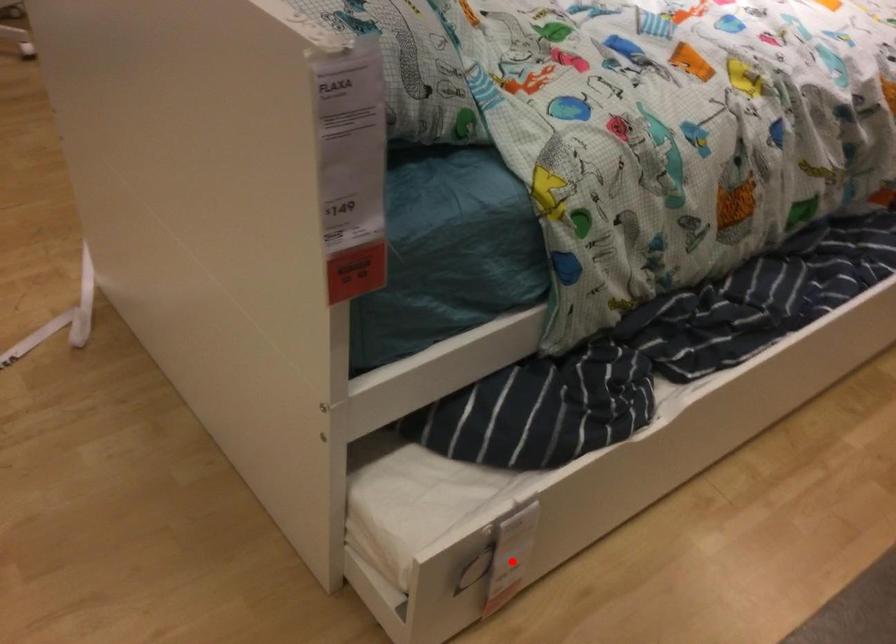
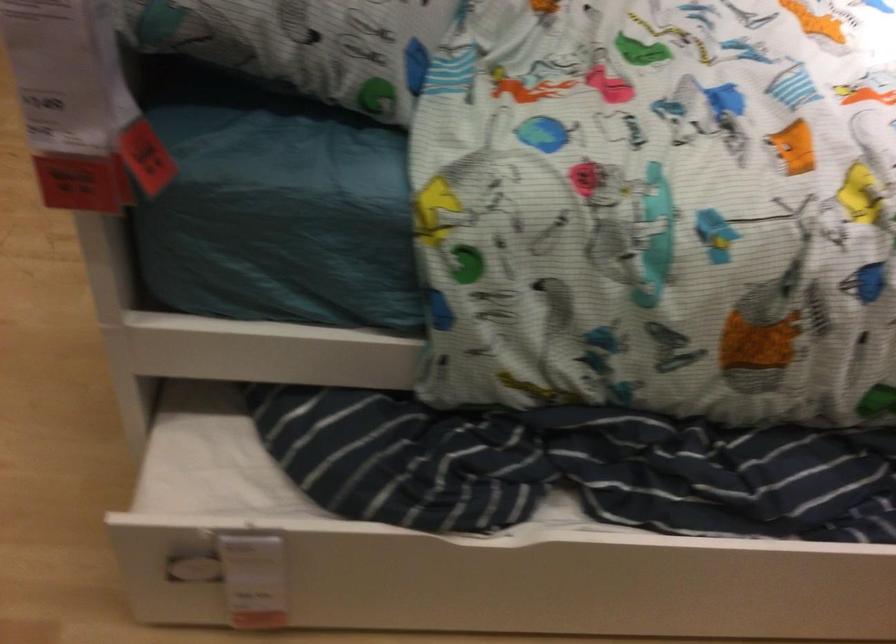
Where in the second image is the point corresponding to the highlighted location from the first image?

(240, 574)